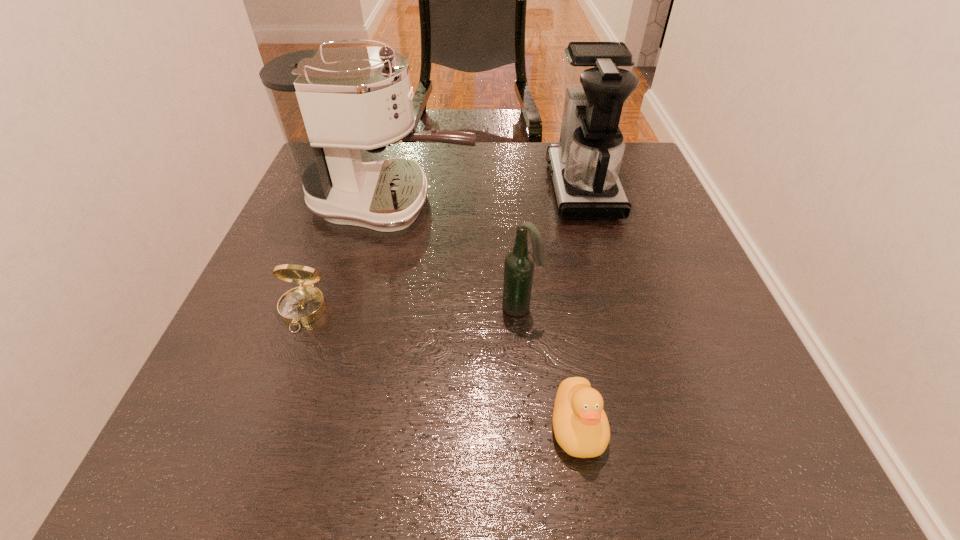
Identify the location of free space located on the right of the beer bottle. (569, 307).

Where is `vacant space located with the dial facing the compass`? vacant space located with the dial facing the compass is located at coordinates (257, 433).

I want to click on object that is positioned at the near edge, so click(x=581, y=428).

Identify the location of coffee maker at the left edge. (330, 103).

Identify the location of compass that is at the left edge. The width and height of the screenshot is (960, 540). (302, 305).

Identify the location of object situated at the right edge. (597, 78).

Image resolution: width=960 pixels, height=540 pixels. I want to click on object positioned at the far left corner, so click(330, 103).

Where is `object positioned at the far right corner`? Image resolution: width=960 pixels, height=540 pixels. object positioned at the far right corner is located at coordinates (597, 78).

Find the location of a particular element. The height and width of the screenshot is (540, 960). vacant position at the far edge of the desktop is located at coordinates (422, 168).

Locate an element on the screen. This screenshot has width=960, height=540. blank space at the near edge of the desktop is located at coordinates (673, 433).